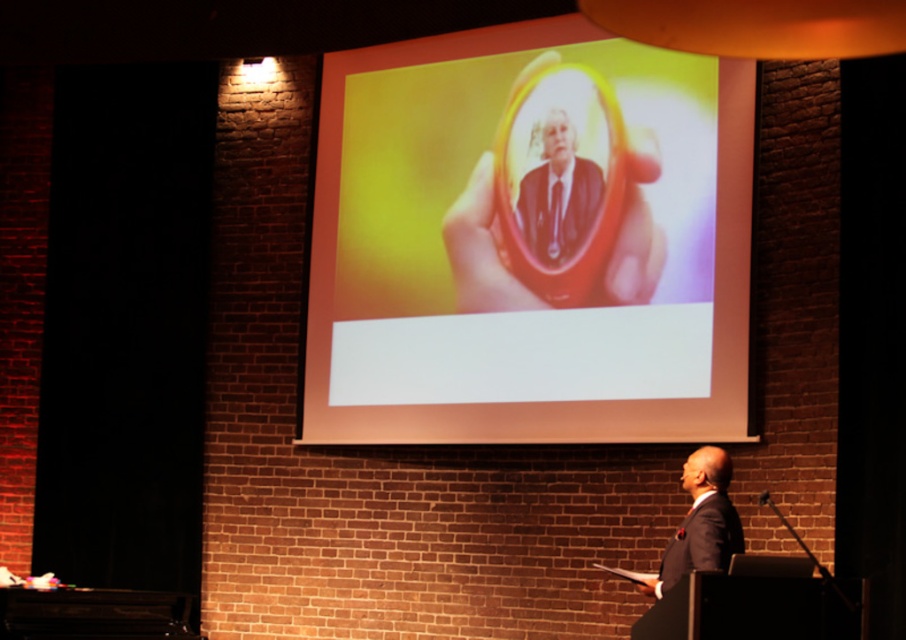
Question: Is matte black suit at center below dark suit at center?

Choices:
 (A) no
 (B) yes

Answer: (A)

Question: Which point is farther to the camera?

Choices:
 (A) dark suit at center
 (B) matte plastic mirror at center

Answer: (B)

Question: Which object is closer to the camera taking this photo?

Choices:
 (A) matte black suit at center
 (B) matte plastic mirror at center

Answer: (B)

Question: Can you confirm if matte black suit at center is wider than dark suit at center?

Choices:
 (A) yes
 (B) no

Answer: (A)

Question: Which object appears closest to the camera in this image?

Choices:
 (A) dark suit at center
 (B) matte plastic mirror at center
 (C) matte black suit at center

Answer: (A)

Question: Considering the relative positions of matte plastic mirror at center and dark suit at center in the image provided, where is matte plastic mirror at center located with respect to dark suit at center?

Choices:
 (A) right
 (B) left

Answer: (B)